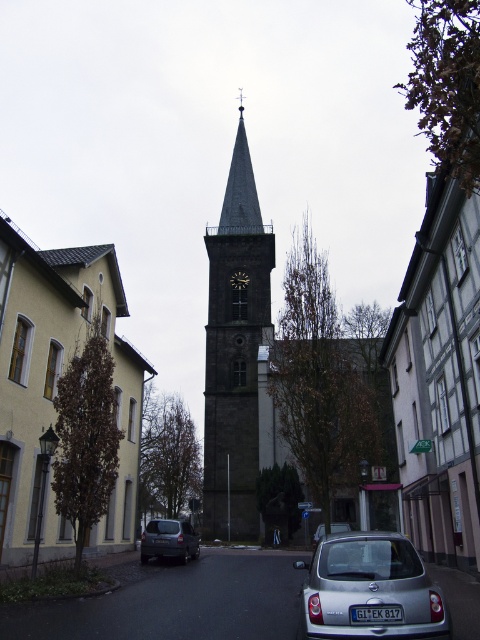
Is point (424, 419) farther from camera compared to point (319, 529)?

No, it is not.

Can you confirm if dark gray stone church at center is thinner than silver metallic car at center?

No, dark gray stone church at center is not thinner than silver metallic car at center.

Image resolution: width=480 pixels, height=640 pixels. In order to click on dark gray stone church at center in this screenshot , I will do `click(439, 376)`.

Between matte black van at center and silver metallic car at center, which one appears on the right side from the viewer's perspective?

From the viewer's perspective, silver metallic car at center appears more on the right side.

Is point (191, 525) more distant than point (339, 524)?

No.

Find the location of `matte black van at center`. matte black van at center is located at coordinates (168, 540).

Is point (471, 202) closer to viewer compared to point (228, 412)?

Yes, it is.

Is dark gray stone church at center positioned behind dark gray stone clock tower at center?

No, dark gray stone church at center is closer to the viewer.

Does point (428, 406) come behind point (227, 196)?

No.

Find the location of a particular element. The width and height of the screenshot is (480, 640). dark gray stone church at center is located at coordinates (439, 376).